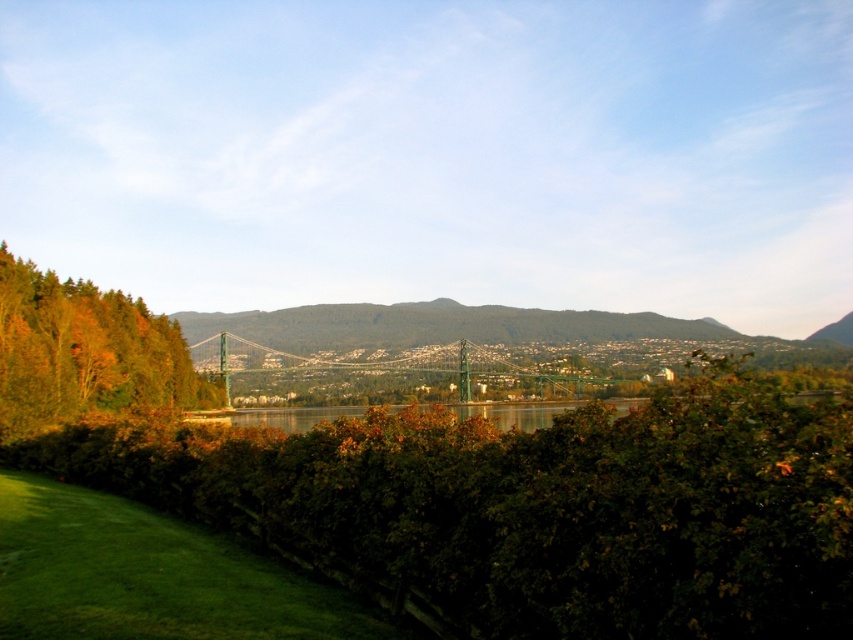
Question: Which point is closer to the camera?

Choices:
 (A) green metallic bridge at center
 (B) green leafy hedge at center
 (C) green leafy tree at left
 (D) greenish reflective water at center

Answer: (B)

Question: Can you confirm if green leafy hedge at center is positioned below green leafy tree at left?

Choices:
 (A) yes
 (B) no

Answer: (A)

Question: Considering the relative positions of green leafy hedge at center and green metallic bridge at center in the image provided, where is green leafy hedge at center located with respect to green metallic bridge at center?

Choices:
 (A) above
 (B) below

Answer: (A)

Question: Which point is farther to the camera?

Choices:
 (A) green leafy tree at left
 (B) greenish reflective water at center
 (C) green leafy hedge at center
 (D) green metallic bridge at center

Answer: (D)

Question: Is green leafy hedge at center to the right of green leafy tree at left from the viewer's perspective?

Choices:
 (A) no
 (B) yes

Answer: (B)

Question: Which object is farther from the camera taking this photo?

Choices:
 (A) green leafy tree at left
 (B) greenish reflective water at center

Answer: (A)